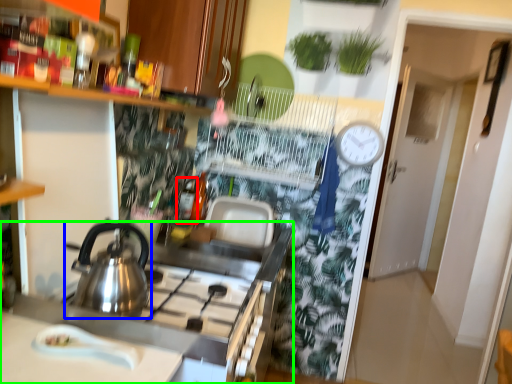
Question: Estimate the real-world distances between objects in this image. Which object is farther from bottle (highlighted by a red box), kettle (highlighted by a blue box) or counter (highlighted by a green box)?

Choices:
 (A) kettle
 (B) counter

Answer: (A)